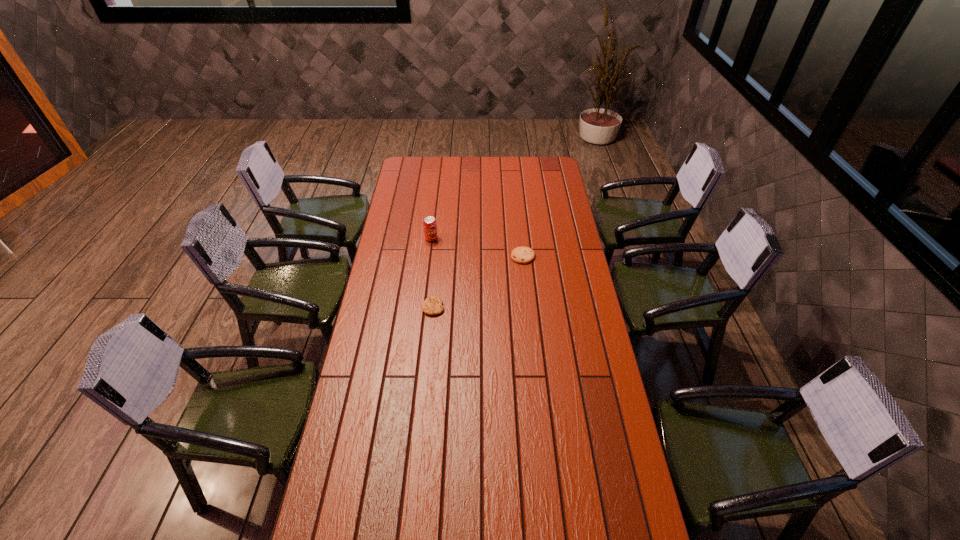
At what (x,y) coordinates should I click in order to perform the action: click on vacant area that lies between the farther cookie and the farthest object. Please return your answer as a coordinate pair (x, y). The height and width of the screenshot is (540, 960). Looking at the image, I should click on (477, 247).

Identify the location of free space between the left cookie and the farthest object. The width and height of the screenshot is (960, 540). (432, 273).

This screenshot has width=960, height=540. I want to click on free area in between the second nearest object and the tallest object, so click(x=477, y=247).

Locate which object is the second closest to the soda. Please provide its 2D coordinates. Your answer should be formatted as a tuple, i.e. [(x, y)], where the tuple contains the x and y coordinates of a point satisfying the conditions above.

[(433, 305)]

Point out which object is positioned as the second nearest to the rightmost object. Please provide its 2D coordinates. Your answer should be formatted as a tuple, i.e. [(x, y)], where the tuple contains the x and y coordinates of a point satisfying the conditions above.

[(433, 305)]

You are a GUI agent. You are given a task and a screenshot of the screen. Output one action in this format:
    pyautogui.click(x=<x>, y=<y>)
    Task: Click on the free region that satisfies the following two spatial constraints: 1. on the front side of the second shortest object; 2. on the left side of the farthest object
    The width and height of the screenshot is (960, 540).
    Given the screenshot: What is the action you would take?
    pyautogui.click(x=429, y=256)

Locate an element on the screen. The image size is (960, 540). vacant point that satisfies the following two spatial constraints: 1. on the back side of the second shortest object; 2. on the right side of the shortest object is located at coordinates (438, 256).